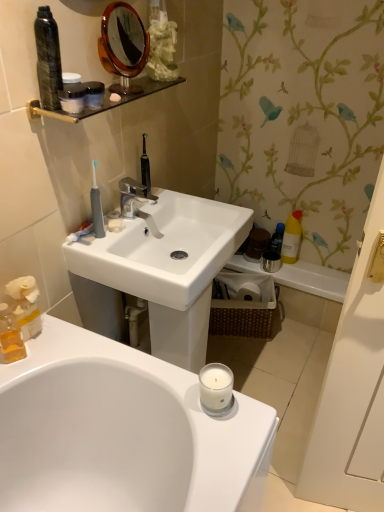
You are a GUI agent. You are given a task and a screenshot of the screen. Output one action in this format:
    pyautogui.click(x=<x>, y=<y>)
    Task: Click on the free spot in front of gray rubber toothbrush at upper left
    
    Given the screenshot: What is the action you would take?
    pyautogui.click(x=111, y=253)